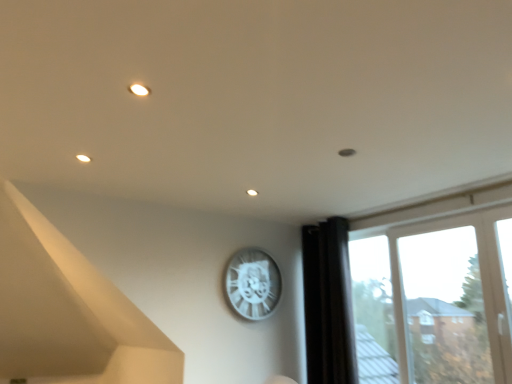
Question: Should I look upward or downward to see white metallic clock at upper center?

Choices:
 (A) up
 (B) down

Answer: (B)

Question: Is transparent glass window at right further to camera compared to white metallic clock at upper center?

Choices:
 (A) yes
 (B) no

Answer: (B)

Question: Is transparent glass window at right bigger than white metallic clock at upper center?

Choices:
 (A) yes
 (B) no

Answer: (A)

Question: Is transparent glass window at right at the right side of white metallic clock at upper center?

Choices:
 (A) no
 (B) yes

Answer: (B)

Question: From the image's perspective, is transparent glass window at right above white metallic clock at upper center?

Choices:
 (A) yes
 (B) no

Answer: (B)

Question: From a real-world perspective, is transparent glass window at right positioned over white metallic clock at upper center based on gravity?

Choices:
 (A) yes
 (B) no

Answer: (B)

Question: From a real-world perspective, is transparent glass window at right below white metallic clock at upper center?

Choices:
 (A) yes
 (B) no

Answer: (A)

Question: From a real-world perspective, is black fabric curtain at right physically below white metallic clock at upper center?

Choices:
 (A) yes
 (B) no

Answer: (A)

Question: Is black fabric curtain at right to the right of white metallic clock at upper center from the viewer's perspective?

Choices:
 (A) no
 (B) yes

Answer: (B)

Question: From a real-world perspective, is black fabric curtain at right physically above white metallic clock at upper center?

Choices:
 (A) yes
 (B) no

Answer: (B)

Question: Is black fabric curtain at right not close to white metallic clock at upper center?

Choices:
 (A) no
 (B) yes

Answer: (A)

Question: From the image's perspective, is black fabric curtain at right on white metallic clock at upper center?

Choices:
 (A) no
 (B) yes

Answer: (A)

Question: Can you confirm if black fabric curtain at right is bigger than white metallic clock at upper center?

Choices:
 (A) yes
 (B) no

Answer: (A)

Question: Does white metallic clock at upper center have a larger size compared to transparent glass window at right?

Choices:
 (A) yes
 (B) no

Answer: (B)